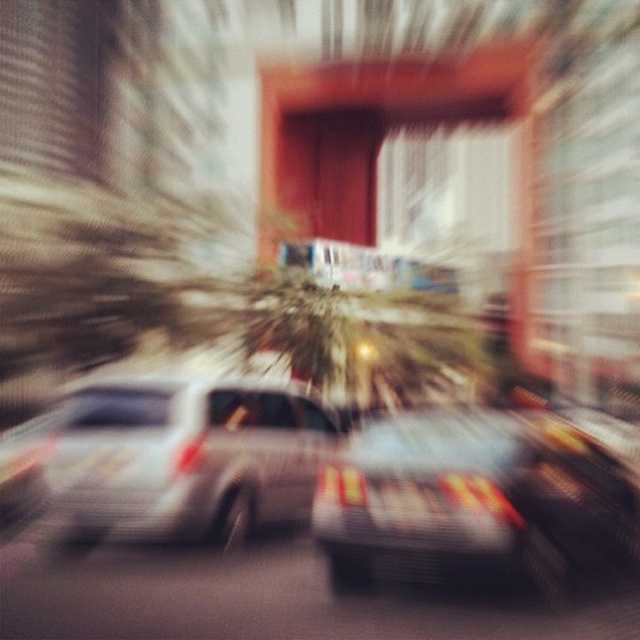
In the scene shown: You are a passenger in a car and see two cars ahead on the road. The cars are a metallic silver car at center and a metallic gray car at center. Which one is more to the left?

The metallic silver car at center is positioned on the left side of metallic gray car at center, so it is more to the left.

You are a passenger in a car and looking out the window. You see two cars ahead, a metallic silver car at center and a metallic gray car at center. Which one appears bigger to you?

The metallic silver car at center appears bigger because it has a larger size compared to the metallic gray car at center.

You are a photographer analyzing the blurred image of a moving car. You notice two points marked at coordinates point (205, 504) and point (509, 429). Based on their positions in the image, which point is closer to the camera?

Point (205, 504) is further to the camera than point (509, 429), so the point closer to the camera is point (509, 429).